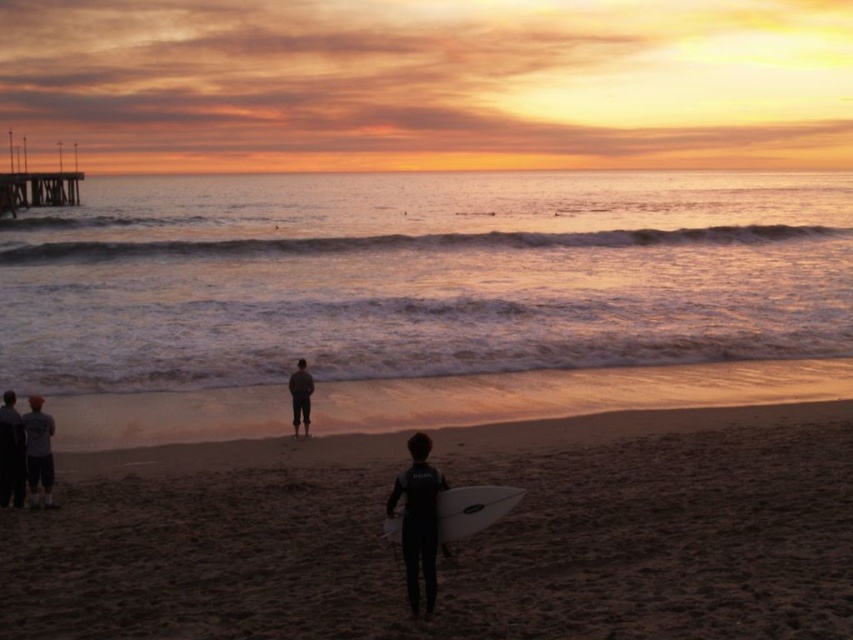
Question: From the image, what is the correct spatial relationship of black matte wetsuit at lower center in relation to dark gray fabric pants at center?

Choices:
 (A) below
 (B) above

Answer: (A)

Question: Where is white matte surfboard at center located in relation to dark gray fabric pants at center in the image?

Choices:
 (A) above
 (B) below

Answer: (B)

Question: Which point is farther to the camera?

Choices:
 (A) dark gray wetsuit at lower left
 (B) black matte wetsuit at lower center
 (C) golden reflective water at center
 (D) brown sandy beach at lower center

Answer: (C)

Question: Which object is positioned closest to the dark gray fabric pants at center?

Choices:
 (A) black matte wetsuit at lower center
 (B) dark gray wetsuit at lower left
 (C) golden reflective water at center

Answer: (B)

Question: Which object is farther from the camera taking this photo?

Choices:
 (A) dark gray wetsuit at lower left
 (B) dark gray fabric pants at center
 (C) black matte wetsuit at lower center
 (D) brown sandy beach at lower center

Answer: (B)

Question: From the image, what is the correct spatial relationship of wooden pier at upper left in relation to dark gray wetsuit at lower left?

Choices:
 (A) left
 (B) right

Answer: (A)